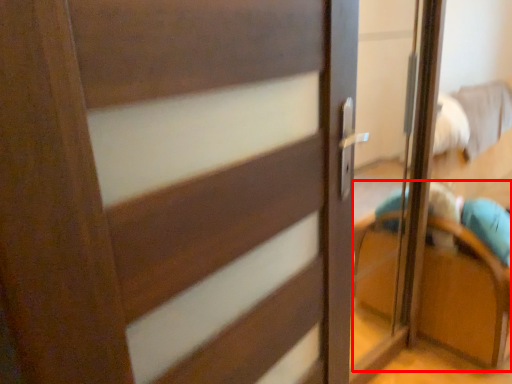
Question: Observing the image, what is the correct spatial positioning of armchair (annotated by the red box) in reference to door?

Choices:
 (A) left
 (B) right

Answer: (B)